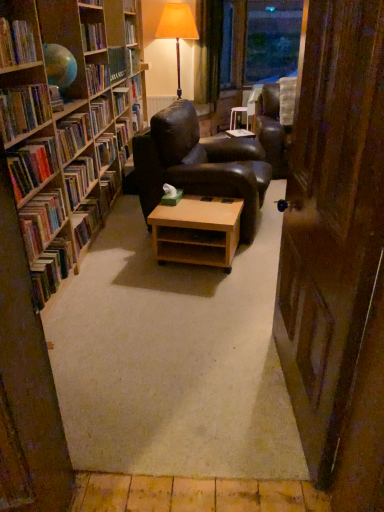
Describe the element at coordinates (65, 118) in the screenshot. I see `wooden bookshelf at left` at that location.

The width and height of the screenshot is (384, 512). Describe the element at coordinates (87, 222) in the screenshot. I see `hardcover book at left, which is the seventh book in top-to-bottom order` at that location.

What do you see at coordinates (236, 115) in the screenshot? Image resolution: width=384 pixels, height=512 pixels. I see `wooden side table at center` at bounding box center [236, 115].

Where is `hardcover book at left, the second book when ordered from bottom to top`? The height and width of the screenshot is (512, 384). hardcover book at left, the second book when ordered from bottom to top is located at coordinates (42, 221).

What is the approximate width of hardcover books at left, marked as the 4th book in a bottom-to-top arrangement?

hardcover books at left, marked as the 4th book in a bottom-to-top arrangement, is 19.27 centimeters in width.

The width and height of the screenshot is (384, 512). I want to click on wooden bookshelf at left, so click(65, 118).

What are the coordinates of `the 1st book to the left of the hardcover books at left, the 5th book in the bottom-to-top sequence, starting your count from the anchor` in the screenshot? It's located at (73, 135).

Based on the photo, considering the relative sizes of hardcover books at left, which is the seventh book in bottom-to-top order, and hardcover books at left, the fifth book viewed from the top, in the image provided, is hardcover books at left, which is the seventh book in bottom-to-top order, thinner than hardcover books at left, the fifth book viewed from the top,?

Incorrect, the width of hardcover books at left, which is the seventh book in bottom-to-top order, is not less than that of hardcover books at left, the fifth book viewed from the top.

Considering the sizes of objects hardcover books at left, marked as the third book in a top-to-bottom arrangement, and hardcover books at left, the 5th book in the bottom-to-top sequence, in the image provided, who is shorter, hardcover books at left, marked as the third book in a top-to-bottom arrangement, or hardcover books at left, the 5th book in the bottom-to-top sequence,?

Standing shorter between the two is hardcover books at left, marked as the third book in a top-to-bottom arrangement.

Does hardcover books at left, which is the seventh book in bottom-to-top order, have a smaller size compared to hardcover books at left, the fifth book viewed from the top?

Correct, hardcover books at left, which is the seventh book in bottom-to-top order, occupies less space than hardcover books at left, the fifth book viewed from the top.

Is hardcover books at left, marked as the 4th book in a bottom-to-top arrangement, inside hardcover book at left, the eighth book viewed from the top?

No, hardcover book at left, the eighth book viewed from the top, does not contain hardcover books at left, marked as the 4th book in a bottom-to-top arrangement.

Is hardcover book at left, the eighth book viewed from the top, positioned with its back to hardcover books at left, marked as the 4th book in a bottom-to-top arrangement?

No, hardcover books at left, marked as the 4th book in a bottom-to-top arrangement, is not at the back of hardcover book at left, the eighth book viewed from the top.

Is hardcover book at left, the eighth book viewed from the top, shorter than hardcover books at left, marked as the 4th book in a bottom-to-top arrangement?

No, hardcover book at left, the eighth book viewed from the top, is not shorter than hardcover books at left, marked as the 4th book in a bottom-to-top arrangement.

Which book is the 1st one when counting from the front of the hardcover book at left, the second book when ordered from bottom to top? Please provide its 2D coordinates.

[(32, 165)]

Is point (37, 94) positioned in front of point (328, 349)?

No, (37, 94) is behind (328, 349).

Does hardcover book at left, the fourth book positioned from the top, have a smaller size compared to wooden door at right?

Yes, hardcover book at left, the fourth book positioned from the top, is smaller than wooden door at right.

In the scene shown: Which object is closer to the camera taking this photo, hardcover book at left, the fourth book positioned from the top, or wooden door at right?

Positioned in front is wooden door at right.

Is hardcover book at left, marked as the 6th book in a bottom-to-top arrangement, facing away from wooden door at right?

hardcover book at left, marked as the 6th book in a bottom-to-top arrangement, is not turned away from wooden door at right.

Do you think hardcover books at left, marked as the 4th book in a bottom-to-top arrangement, is within transparent glass window screen at upper center, or outside of it?

hardcover books at left, marked as the 4th book in a bottom-to-top arrangement, lies outside transparent glass window screen at upper center.

Is hardcover books at left, marked as the 4th book in a bottom-to-top arrangement, shorter than transparent glass window screen at upper center?

Indeed, hardcover books at left, marked as the 4th book in a bottom-to-top arrangement, has a lesser height compared to transparent glass window screen at upper center.

Consider the image. From a real-world perspective, is hardcover books at left, marked as the 4th book in a bottom-to-top arrangement, positioned over transparent glass window screen at upper center based on gravity?

No.

From a real-world perspective, who is located lower, hardcover book at left, which ranks as the first book in top-to-bottom order, or matte brown table lamp at center?

In real-world perspective, hardcover book at left, which ranks as the first book in top-to-bottom order, is lower.

Does hardcover book at left, which is the 9th book from bottom to top, have a greater height compared to matte brown table lamp at center?

In fact, hardcover book at left, which is the 9th book from bottom to top, may be shorter than matte brown table lamp at center.

Image resolution: width=384 pixels, height=512 pixels. Identify the location of book that is the 1st one when counting downward from the matte brown table lamp at center (from the image's perspective). (82, 128).

In the scene shown: Is hardcover book at left, which is the 9th book from bottom to top, facing away from matte brown table lamp at center?

No, hardcover book at left, which is the 9th book from bottom to top, is not facing the opposite direction of matte brown table lamp at center.

Can you tell me how much hardcover books at left, the 5th book in the bottom-to-top sequence, and hardcover book at left, marked as the 6th book in a bottom-to-top arrangement, differ in facing direction?

The angular difference between hardcover books at left, the 5th book in the bottom-to-top sequence, and hardcover book at left, marked as the 6th book in a bottom-to-top arrangement, is 0.000827 degrees.

Who is taller, hardcover books at left, the 5th book in the bottom-to-top sequence, or hardcover book at left, marked as the 6th book in a bottom-to-top arrangement?

Standing taller between the two is hardcover books at left, the 5th book in the bottom-to-top sequence.

Is hardcover books at left, the 5th book in the bottom-to-top sequence, beside hardcover book at left, marked as the 6th book in a bottom-to-top arrangement?

They are not placed beside each other.

Are hardcover book at left, the eighth book viewed from the top, and wooden side table at center making contact?

No.

From a real-world perspective, relative to wooden side table at center, is hardcover book at left, the eighth book viewed from the top, vertically above or below?

hardcover book at left, the eighth book viewed from the top, is above wooden side table at center.

How many degrees apart are the facing directions of hardcover book at left, the second book when ordered from bottom to top, and wooden side table at center?

There is a 102-degree angle between the facing directions of hardcover book at left, the second book when ordered from bottom to top, and wooden side table at center.

This screenshot has width=384, height=512. I want to click on the 1st book to the right when counting from the hardcover books at left, marked as the third book in a top-to-bottom arrangement, so click(x=79, y=179).

Find the location of a particular element. book that is the 1st one when counting backward from the hardcover books at left, marked as the 4th book in a bottom-to-top arrangement is located at coordinates (42, 221).

When comparing their distances from green velvet curtain at upper center, does wooden side table at center or matte brown table lamp at center seem further?

wooden side table at center is further to green velvet curtain at upper center.

Which object lies nearer to the anchor point wooden door at right, hardcover books at left, the 5th book in the bottom-to-top sequence, or transparent glass window screen at upper center?

hardcover books at left, the 5th book in the bottom-to-top sequence, lies closer to wooden door at right than the other object.

From the image, which object appears to be nearer to hardcover book at left, which is counted as the eighth book, starting from the bottom, hardcover book at left, the fourth book positioned from the top, or light brown wooden table at center?

Based on the image, hardcover book at left, the fourth book positioned from the top, appears to be nearer to hardcover book at left, which is counted as the eighth book, starting from the bottom.

Based on their spatial positions, is hardcover book at left, which is the 3th book in bottom-to-top order, or leather armchair at center further from hardcover book at left, the ninth book in the top-to-bottom sequence?

Based on the image, leather armchair at center appears to be further to hardcover book at left, the ninth book in the top-to-bottom sequence.

Looking at the image, which one is located further to hardcover book at left, the eighth book viewed from the top, wooden side table at center or transparent glass window screen at upper center?

transparent glass window screen at upper center lies further to hardcover book at left, the eighth book viewed from the top, than the other object.

From the image, which object appears to be farther from light brown wooden table at center, green velvet curtain at upper center or hardcover book at left, positioned as the first book in bottom-to-top order?

Based on the image, green velvet curtain at upper center appears to be further to light brown wooden table at center.

Based on the photo, considering their positions, is leather armchair at center positioned closer to hardcover book at left, positioned as the first book in bottom-to-top order, than matte brown table lamp at center?

The object closer to hardcover book at left, positioned as the first book in bottom-to-top order, is leather armchair at center.

Estimate the real-world distances between objects in this image. Which object is closer to hardcover books at left, marked as the 4th book in a bottom-to-top arrangement, leather armchair at center or wooden door at right?

The object closer to hardcover books at left, marked as the 4th book in a bottom-to-top arrangement, is leather armchair at center.

Where is `book positioned between hardcover book at left, which is the 3th book in bottom-to-top order, and matte brown table lamp at center from near to far`? The width and height of the screenshot is (384, 512). book positioned between hardcover book at left, which is the 3th book in bottom-to-top order, and matte brown table lamp at center from near to far is located at coordinates (82, 128).

Find the location of `chair between light brown wooden table at center and matte brown table lamp at center along the z-axis`. chair between light brown wooden table at center and matte brown table lamp at center along the z-axis is located at coordinates (199, 165).

I want to click on table between hardcover books at left, marked as the 4th book in a bottom-to-top arrangement, and matte brown table lamp at center, along the z-axis, so click(197, 231).

Locate an element on the screen. This screenshot has width=384, height=512. book between hardcover book at left, which is the 3th book in bottom-to-top order, and leather armchair at center from left to right is located at coordinates 82,128.